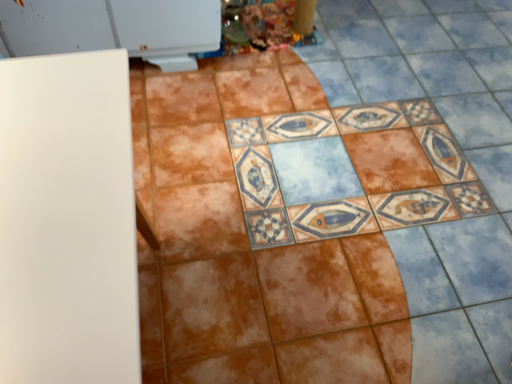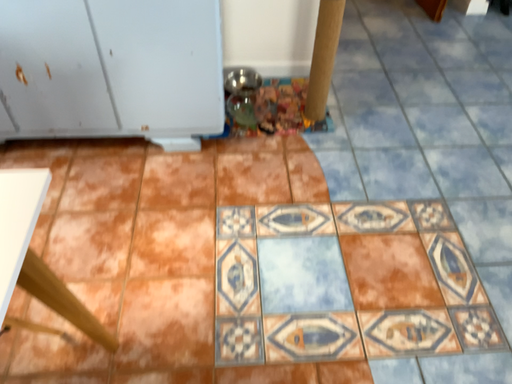
Question: How did the camera likely rotate when shooting the video?

Choices:
 (A) rotated downward
 (B) rotated upward

Answer: (B)